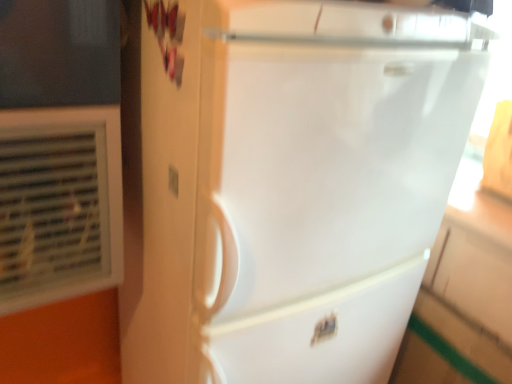
Question: In terms of width, does white glossy refrigerator at center look wider or thinner when compared to matte white outlet at center?

Choices:
 (A) wide
 (B) thin

Answer: (A)

Question: From the image's perspective, relative to matte white outlet at center, is white glossy refrigerator at center above or below?

Choices:
 (A) below
 (B) above

Answer: (A)

Question: Estimate the real-world distances between objects in this image. Which object is farther from the matte white outlet at center?

Choices:
 (A) white glossy refrigerator at center
 (B) white plastic air conditioning unit at left

Answer: (A)

Question: Estimate the real-world distances between objects in this image. Which object is closer to the white glossy refrigerator at center?

Choices:
 (A) matte white outlet at center
 (B) white plastic air conditioning unit at left

Answer: (B)